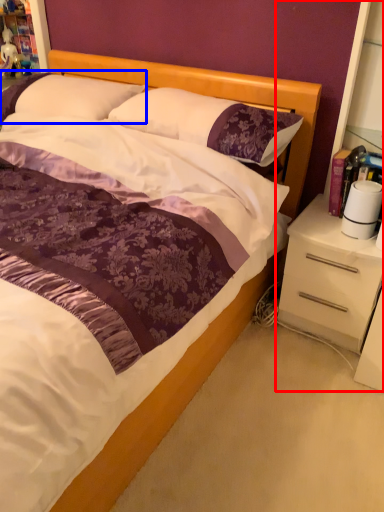
Question: Which object appears farthest to the camera in this image, dresser (highlighted by a red box) or pillow (highlighted by a blue box)?

Choices:
 (A) dresser
 (B) pillow

Answer: (B)